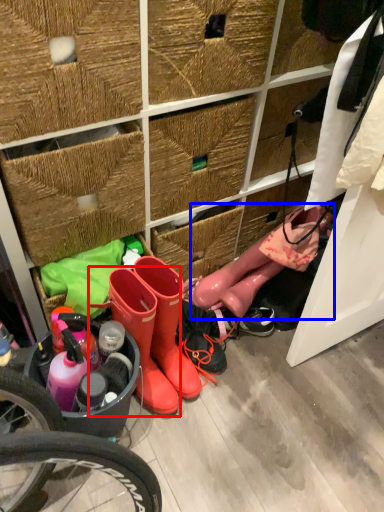
Question: Which object is further to the camera taking this photo, footwear (highlighted by a red box) or footwear (highlighted by a blue box)?

Choices:
 (A) footwear
 (B) footwear

Answer: (B)